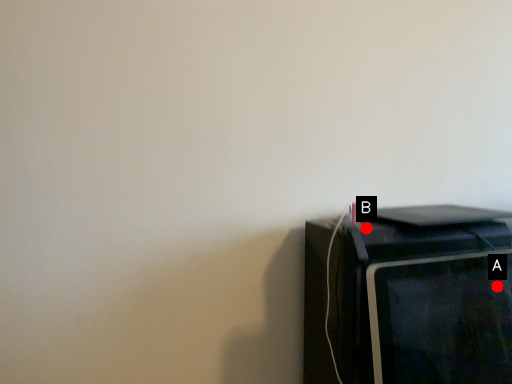
Question: Two points are circled on the image, labeled by A and B beside each circle. Which point is closer to the camera?

Choices:
 (A) A is closer
 (B) B is closer

Answer: (A)